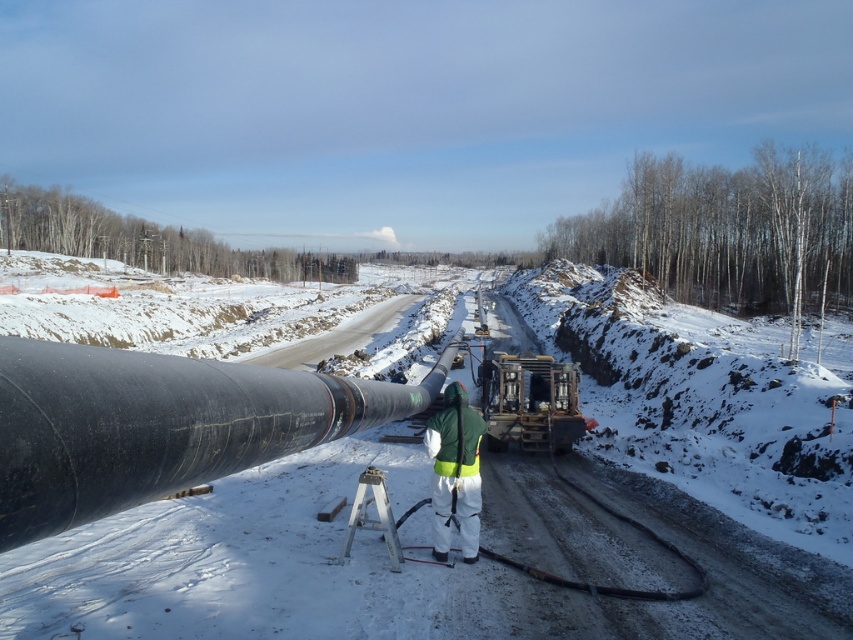
Is point (341, 484) positioned in front of point (88, 499)?

No, (341, 484) is further to viewer.

Does black rubber pipe at center appear on the right side of black rubber pipe at left?

Yes, black rubber pipe at center is to the right of black rubber pipe at left.

This screenshot has height=640, width=853. I want to click on black rubber pipe at center, so click(x=369, y=566).

Who is higher up, black rubber pipe at center or green reflective safety suit at center?

green reflective safety suit at center

This screenshot has height=640, width=853. What do you see at coordinates (369, 566) in the screenshot? I see `black rubber pipe at center` at bounding box center [369, 566].

Does point (531, 522) come behind point (467, 424)?

Yes, it is behind point (467, 424).

Locate an element on the screen. The image size is (853, 640). black rubber pipe at center is located at coordinates tap(369, 566).

Consider the image. Between metallic yellow forklift at center and green reflective safety suit at center, which one appears on the left side from the viewer's perspective?

Positioned to the left is green reflective safety suit at center.

Can you confirm if metallic yellow forklift at center is positioned to the left of green reflective safety suit at center?

No, metallic yellow forklift at center is not to the left of green reflective safety suit at center.

This screenshot has height=640, width=853. What do you see at coordinates (531, 401) in the screenshot?
I see `metallic yellow forklift at center` at bounding box center [531, 401].

What are the coordinates of `metallic yellow forklift at center` in the screenshot? It's located at (531, 401).